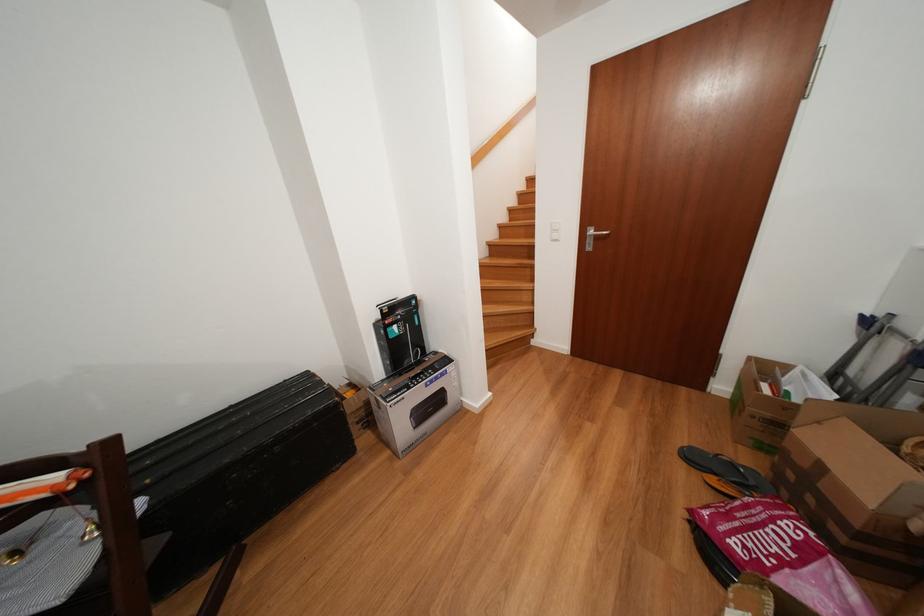
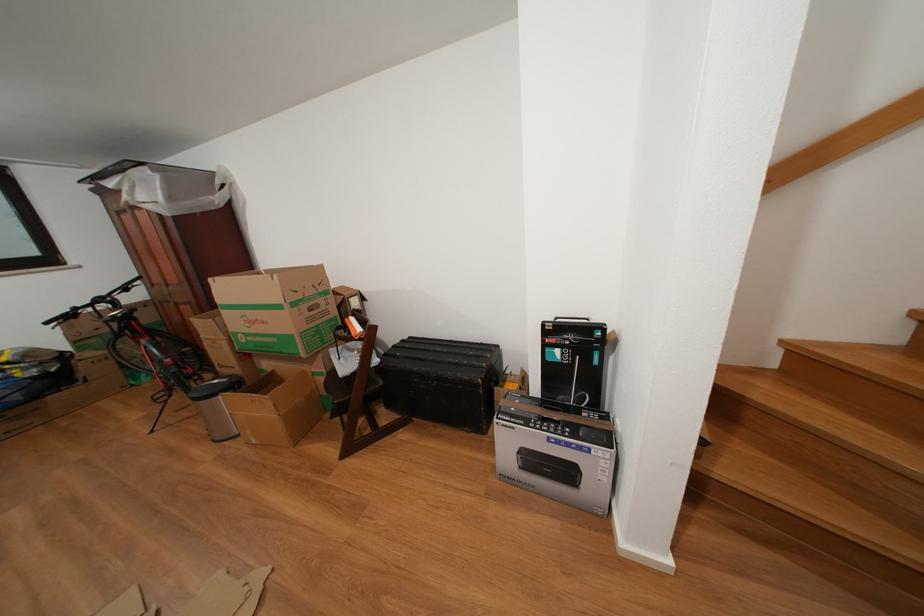
How did the camera likely rotate?

The rotation direction of the camera is left-down.